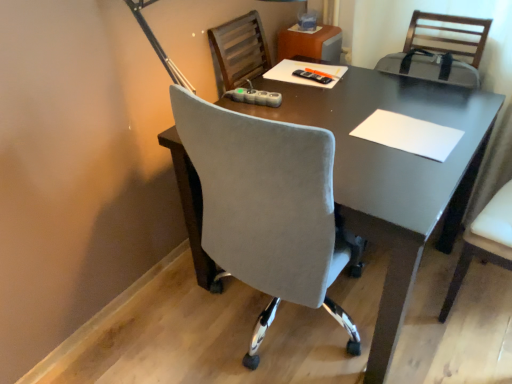
This screenshot has width=512, height=384. Find the location of `vacant space to the right of white paper at center`. vacant space to the right of white paper at center is located at coordinates [460, 114].